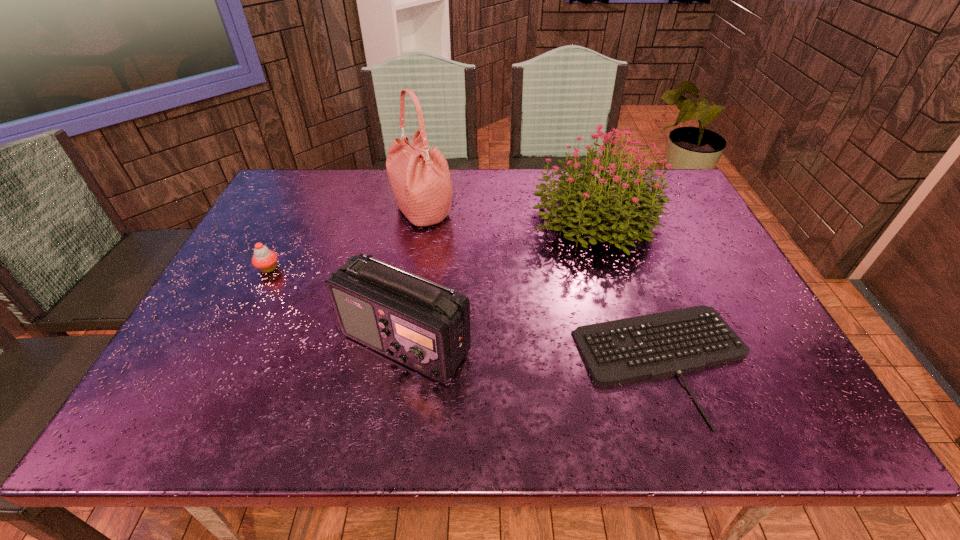
At what (x,y) coordinates should I click in order to perform the action: click on the tallest object. Please return your answer as a coordinate pair (x, y). Image resolution: width=960 pixels, height=540 pixels. Looking at the image, I should click on (420, 179).

You are a GUI agent. You are given a task and a screenshot of the screen. Output one action in this format:
    pyautogui.click(x=<x>, y=<y>)
    Task: Click on the second tallest object
    The width and height of the screenshot is (960, 540).
    Given the screenshot: What is the action you would take?
    pyautogui.click(x=586, y=197)

You are a GUI agent. You are given a task and a screenshot of the screen. Output one action in this format:
    pyautogui.click(x=<x>, y=<y>)
    Task: Click on the third shortest object
    
    Given the screenshot: What is the action you would take?
    pyautogui.click(x=425, y=326)

The width and height of the screenshot is (960, 540). In order to click on the leftmost object in this screenshot , I will do `click(265, 260)`.

Locate an element on the screen. The image size is (960, 540). the third nearest object is located at coordinates (265, 260).

Image resolution: width=960 pixels, height=540 pixels. In order to click on computer keyboard in this screenshot , I will do `click(657, 345)`.

I want to click on free space located 0.080m on the back of the tallest object, so click(427, 178).

You are a GUI agent. You are given a task and a screenshot of the screen. Output one action in this format:
    pyautogui.click(x=<x>, y=<y>)
    Task: Click on the free space located on the front of the second tallest object
    The image size is (960, 540).
    Given the screenshot: What is the action you would take?
    pyautogui.click(x=638, y=358)

At what (x,y) coordinates should I click in order to perform the action: click on vacant point located 0.100m on the front panel of the third shortest object. Please return your answer as a coordinate pair (x, y). This screenshot has width=960, height=540. Looking at the image, I should click on point(392,434).

The height and width of the screenshot is (540, 960). I want to click on free space located on the right of the leftmost object, so click(x=346, y=268).